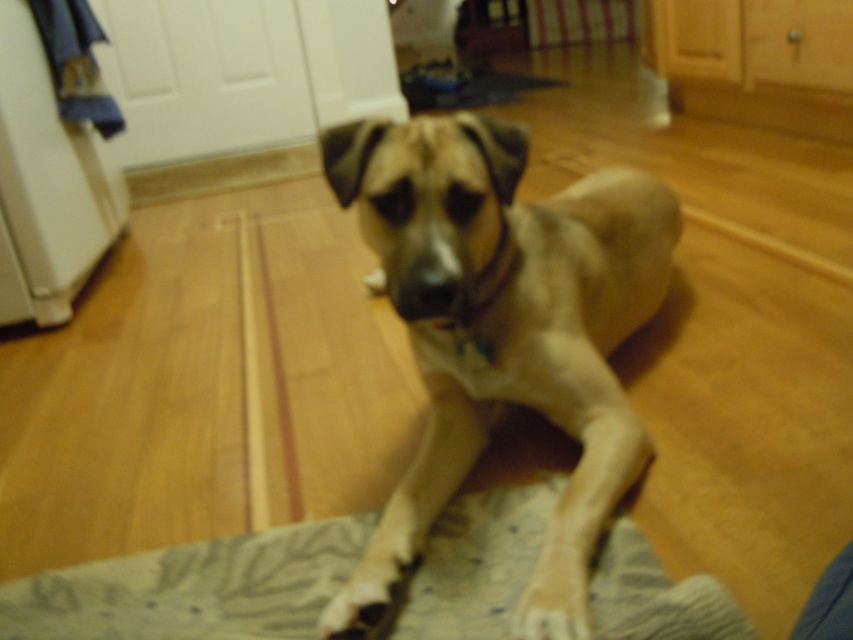
Is point (584, 220) in front of point (444, 573)?

No.

Find the location of a particular element. tan smooth dog at center is located at coordinates (502, 332).

Find the location of a particular element. tan smooth dog at center is located at coordinates (502, 332).